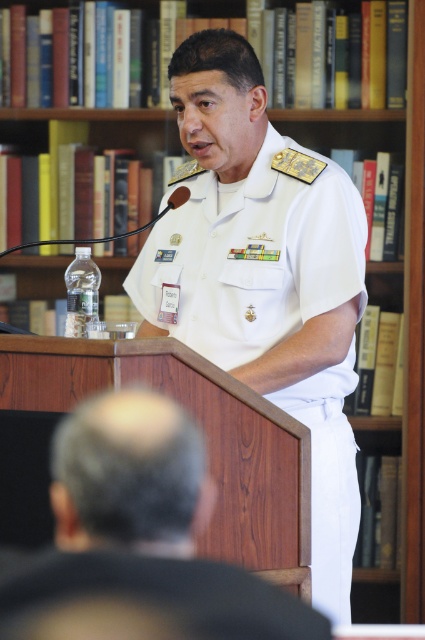
How distant is white cotton uniform at center from white uniform at center?

white cotton uniform at center is 36.49 inches away from white uniform at center.

Is the position of white cotton uniform at center less distant than that of white uniform at center?

No.

Which is in front, point (300, 320) or point (124, 582)?

Point (124, 582) is in front.

Where is `white cotton uniform at center`? white cotton uniform at center is located at coordinates (274, 310).